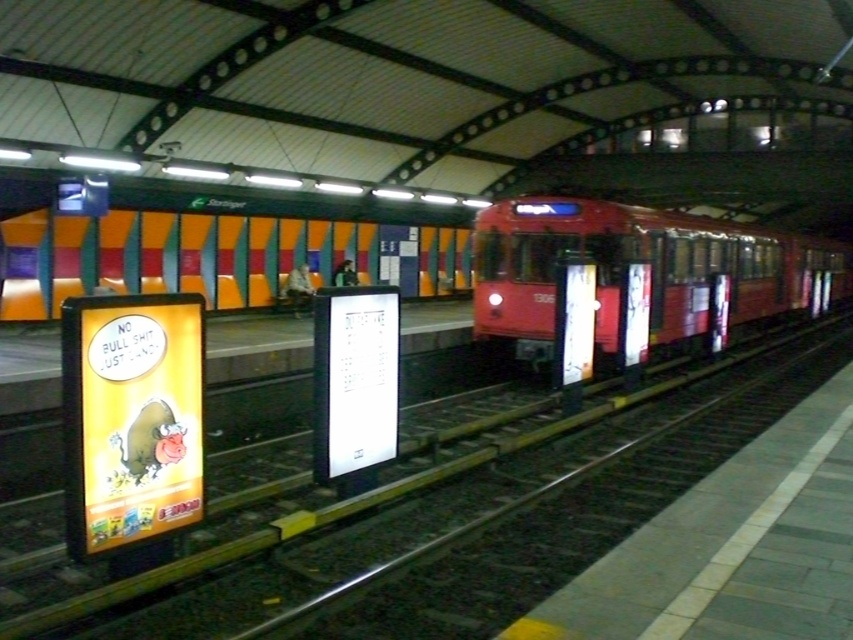
Question: Which of the following is the closest to the observer?

Choices:
 (A) matte red train at center
 (B) metal at left

Answer: (B)

Question: Does metal at left have a lesser width compared to matte red train at center?

Choices:
 (A) yes
 (B) no

Answer: (A)

Question: Can you confirm if metal at left is positioned above matte red train at center?

Choices:
 (A) no
 (B) yes

Answer: (A)

Question: Is metal at left in front of matte red train at center?

Choices:
 (A) no
 (B) yes

Answer: (B)

Question: Which of the following is the farthest from the observer?

Choices:
 (A) (477, 568)
 (B) (843, 288)

Answer: (B)